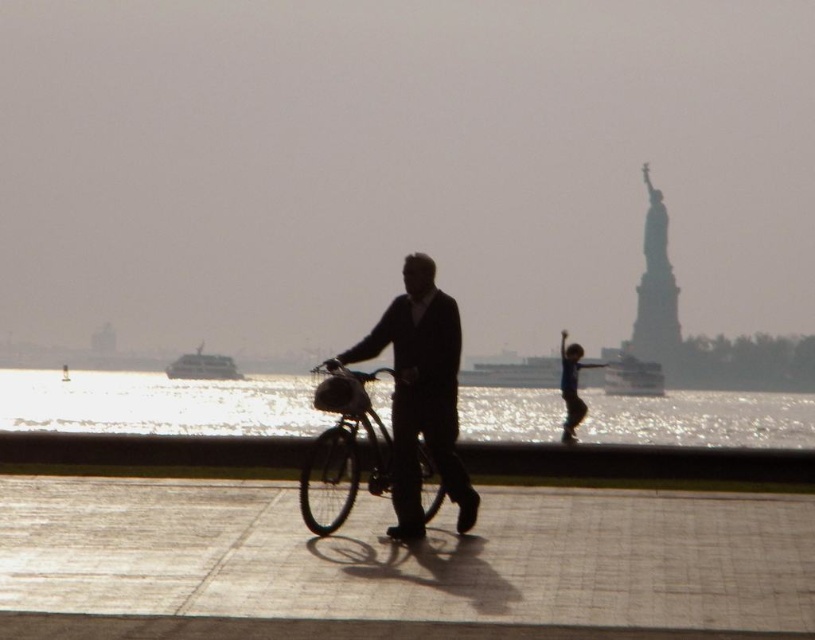
Question: Is dark suit at center further to camera compared to metallic silver bicycle at center?

Choices:
 (A) yes
 (B) no

Answer: (A)

Question: Considering the real-world distances, which object is farthest from the smooth concrete sidewalk at center?

Choices:
 (A) metallic silver bicycle at center
 (B) translucent glass water at center
 (C) blue fabric shirt at center
 (D) dark suit at center

Answer: (B)

Question: Estimate the real-world distances between objects in this image. Which object is farther from the dark suit at center?

Choices:
 (A) translucent glass water at center
 (B) blue fabric shirt at center

Answer: (A)

Question: Can you confirm if smooth concrete sidewalk at center is thinner than dark suit at center?

Choices:
 (A) no
 (B) yes

Answer: (A)

Question: Based on their relative distances, which object is farther from the translucent glass water at center?

Choices:
 (A) blue fabric shirt at center
 (B) smooth concrete sidewalk at center
 (C) dark suit at center
 (D) metallic silver bicycle at center

Answer: (C)

Question: Does smooth concrete sidewalk at center have a lesser width compared to translucent glass water at center?

Choices:
 (A) no
 (B) yes

Answer: (B)